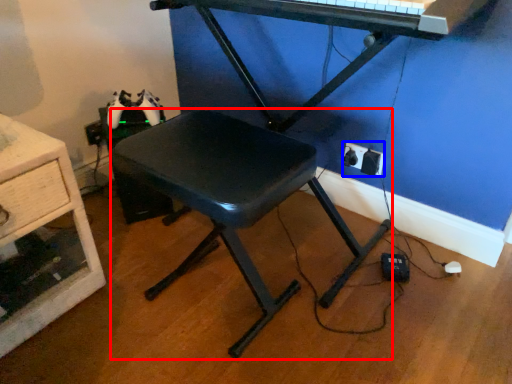
Question: Which object is further to the camera taking this photo, stool (highlighted by a red box) or electric outlet (highlighted by a blue box)?

Choices:
 (A) stool
 (B) electric outlet

Answer: (B)